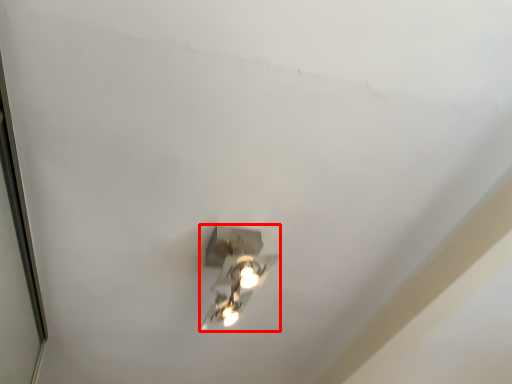
Question: Observing the image, what is the correct spatial positioning of lamp (annotated by the red box) in reference to glass door?

Choices:
 (A) right
 (B) left

Answer: (A)